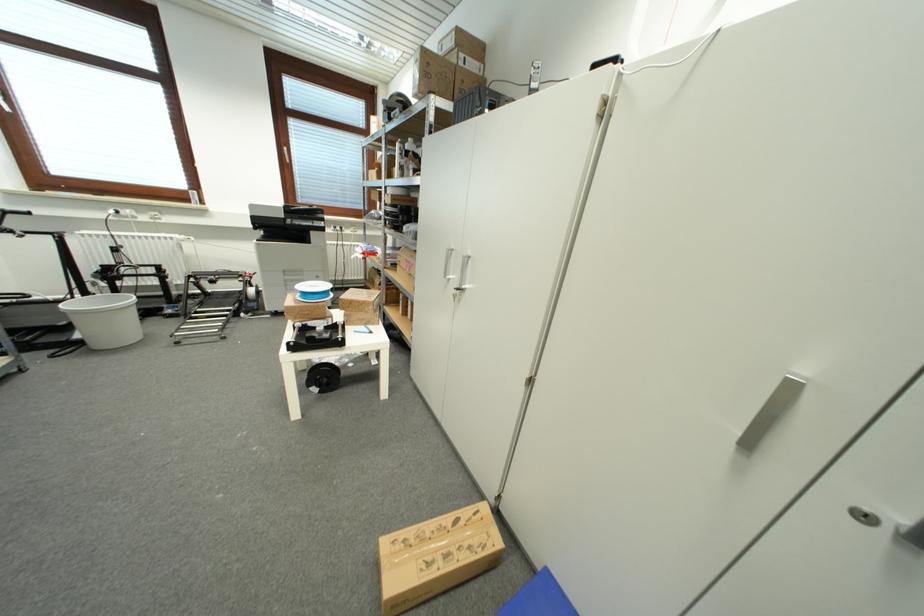
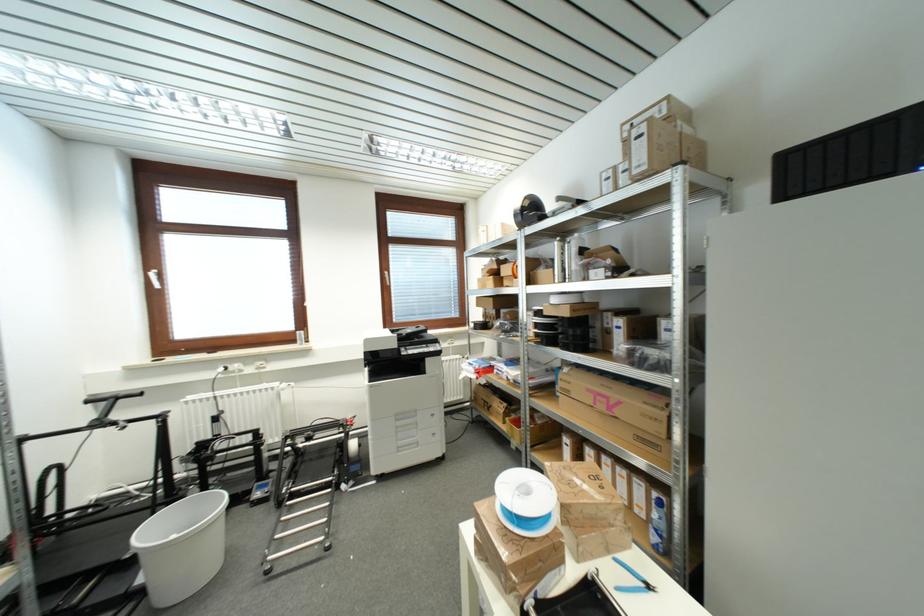
In the second image, find the point that corresponds to the point at 375,334 in the first image.

(652, 590)